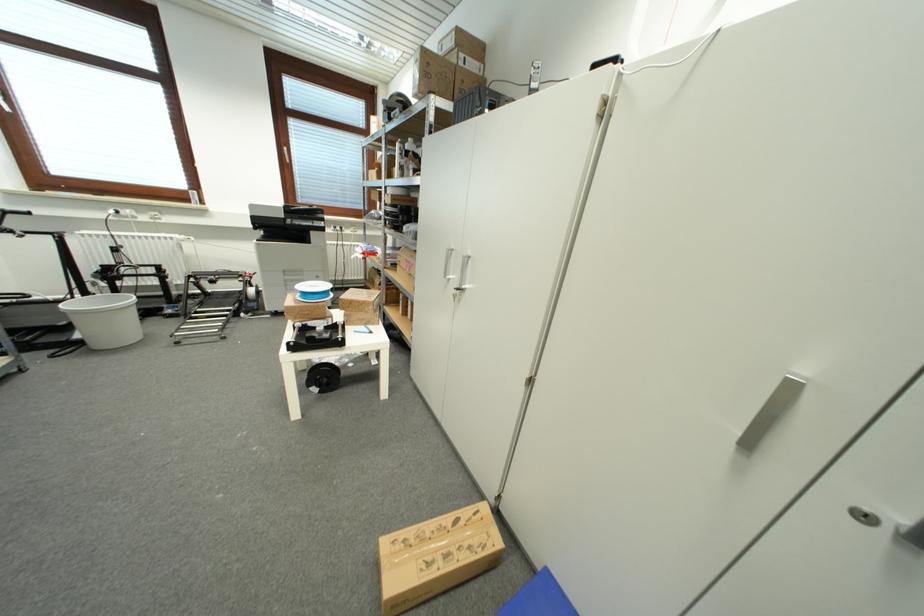
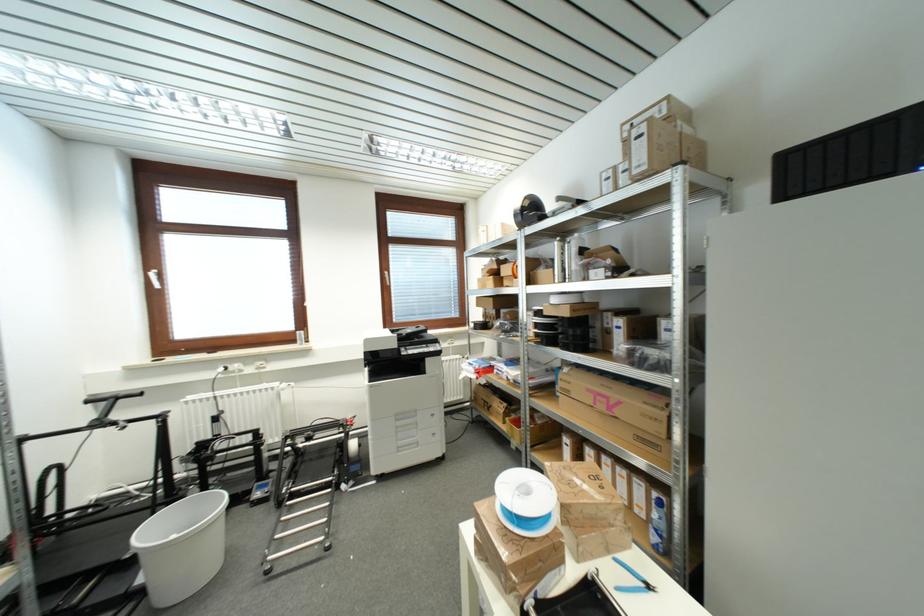
In the second image, find the point that corresponds to the point at 375,334 in the first image.

(652, 590)